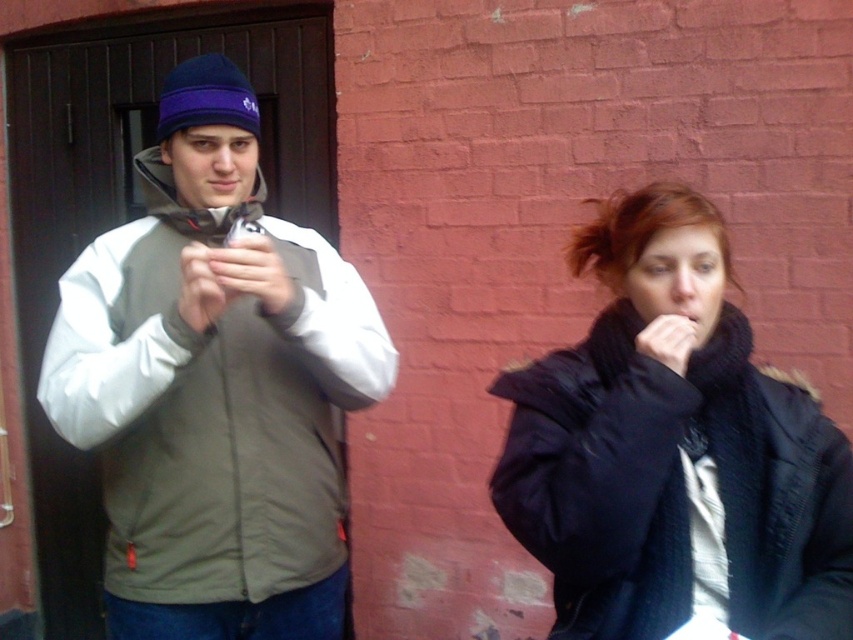
Is olive-green jacket at center bigger than dark blue knit scarf at right?

Indeed, olive-green jacket at center has a larger size compared to dark blue knit scarf at right.

Who is taller, olive-green jacket at center or dark blue knit scarf at right?

With more height is olive-green jacket at center.

Is point (155, 400) farther from viewer compared to point (744, 324)?

No, (155, 400) is in front of (744, 324).

In order to click on olive-green jacket at center in this screenshot , I will do `click(215, 385)`.